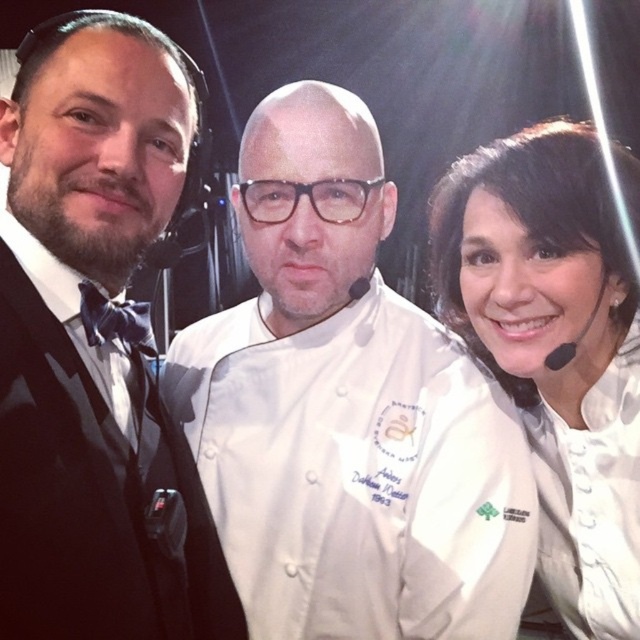
What is the relationship between the width of the white chef coat at center and the black satin bow tie at left?

The white chef coat at center is wider than the black satin bow tie at left.

You are a photographer adjusting the lighting for the group photo. You need to ensure that the black satin bow tie at left and the white matte chef coat at center are both well lit. Considering their sizes, which object requires more focused lighting to ensure visibility?

The black satin bow tie at left requires more focused lighting because it has a smaller size compared to the white matte chef coat at center, making it harder to see in the photo without proper illumination.